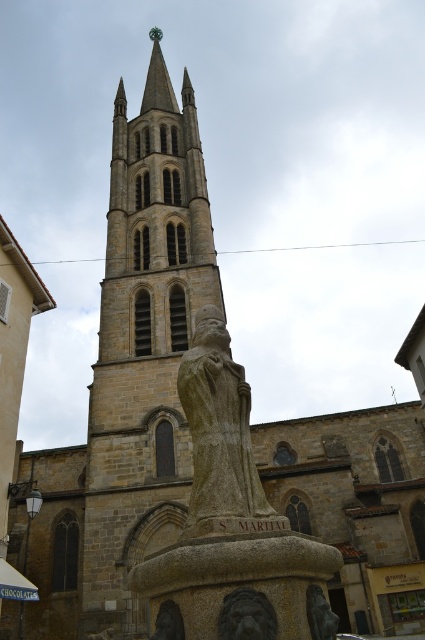
You are standing in front of the historic stone church and want to determine which of the two points, point (249, 602) or point (153, 634), is nearer to you. Based on the scene description, which point is closer?

Point (249, 602) is closer to the viewer than point (153, 634).

You are a visitor standing at the entrance of the historic stone church. You see the gray stone statue at center and the matte stone lion at lower center. Which object is taller?

The gray stone statue at center is taller than the matte stone lion at lower center.